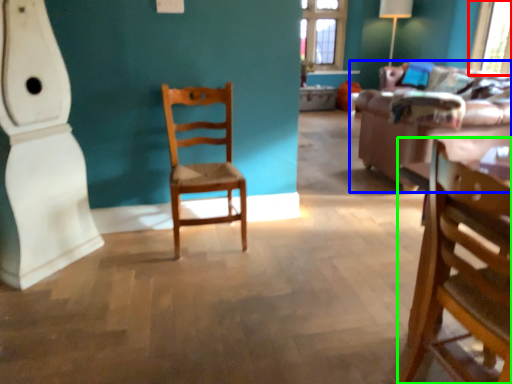
Question: Based on their relative distances, which object is nearer to window screen (highlighted by a red box)? Choose from studio couch (highlighted by a blue box) and chair (highlighted by a green box).

Choices:
 (A) studio couch
 (B) chair

Answer: (A)